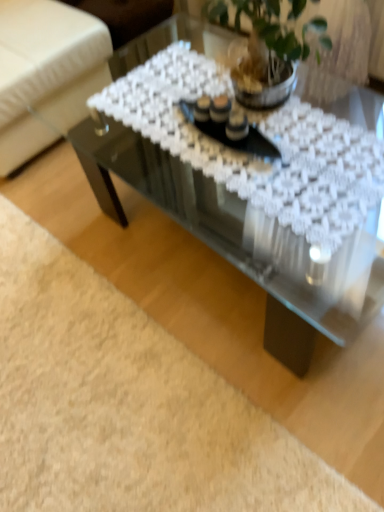
Where is `free space behind clear glass plate at center`? free space behind clear glass plate at center is located at coordinates (185, 86).